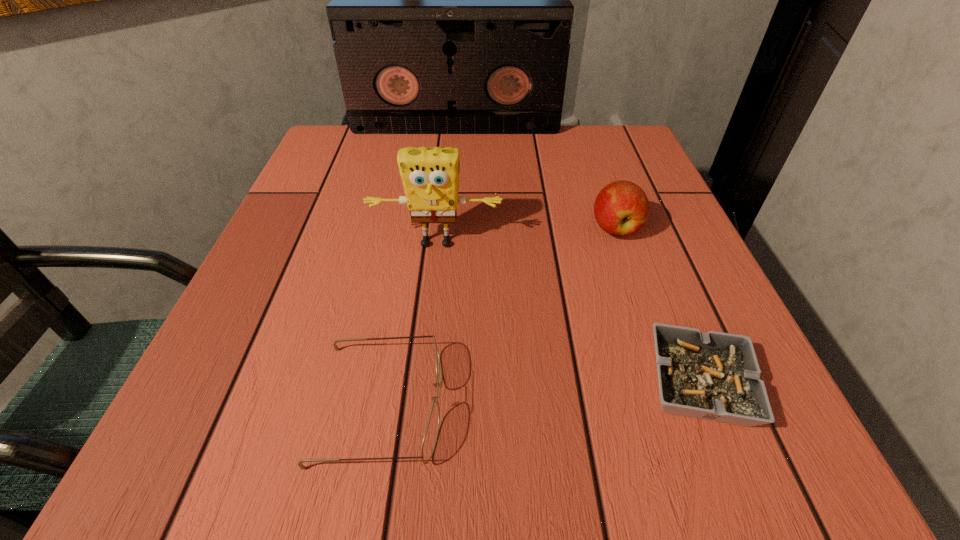
Identify the location of free space located on the left of the ashtray. (590, 384).

Find the location of `object at the far edge`. object at the far edge is located at coordinates (451, 13).

Where is `spectacles present at the near edge`? spectacles present at the near edge is located at coordinates (429, 442).

Where is `ashtray at the near edge`? ashtray at the near edge is located at coordinates (715, 376).

At what (x,y) coordinates should I click in order to perform the action: click on object that is at the left edge. Please return your answer as a coordinate pair (x, y). Looking at the image, I should click on (451, 13).

Where is `apple at the right edge`? This screenshot has width=960, height=540. apple at the right edge is located at coordinates (621, 208).

This screenshot has height=540, width=960. In order to click on ashtray at the right edge in this screenshot , I will do `click(715, 376)`.

What are the coordinates of `object present at the far left corner` in the screenshot? It's located at (451, 13).

Find the location of a particular element. Image resolution: width=960 pixels, height=540 pixels. object located at the near right corner is located at coordinates (715, 376).

The image size is (960, 540). In the image, there is a desktop. Find the location of `free space at the far edge`. free space at the far edge is located at coordinates (503, 149).